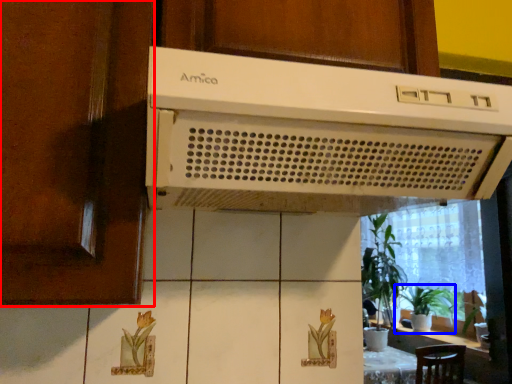
Question: Among these objects, which one is nearest to the camera, screen door (highlighted by a red box) or houseplant (highlighted by a blue box)?

Choices:
 (A) screen door
 (B) houseplant

Answer: (A)